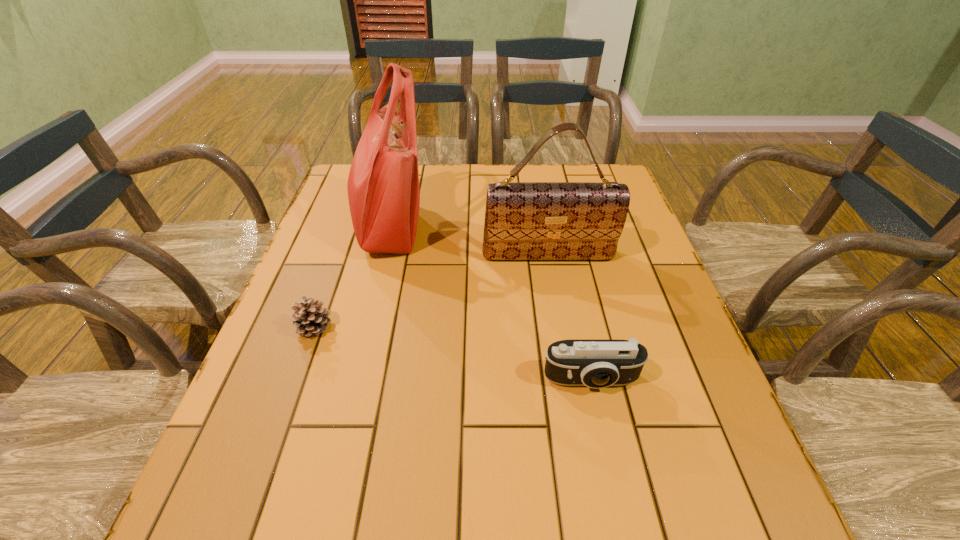
At what (x,y) coordinates should I click in order to perform the action: click on free space at the right edge. Please return your answer as a coordinate pair (x, y). Looking at the image, I should click on coord(729,483).

Locate an element on the screen. free space at the far left corner of the desktop is located at coordinates (341, 194).

The image size is (960, 540). Identify the location of vacant space at the far right corner of the desktop. (592, 166).

I want to click on vacant region at the near right corner of the desktop, so click(x=723, y=514).

I want to click on empty location between the shortest object and the shorter handbag, so click(432, 291).

At what (x,y) coordinates should I click in order to perform the action: click on vacant area that lies between the third farthest object and the third tallest object. Please return your answer as a coordinate pair (x, y). Looking at the image, I should click on (453, 354).

Where is `free space between the right handbag and the shortest object`? The height and width of the screenshot is (540, 960). free space between the right handbag and the shortest object is located at coordinates (432, 291).

Locate an element on the screen. Image resolution: width=960 pixels, height=540 pixels. empty space that is in between the camera and the pinecone is located at coordinates (453, 354).

I want to click on vacant space in between the taller handbag and the second shortest object, so click(x=490, y=303).

The image size is (960, 540). Find the location of `free point between the second tallest object and the second nearest object`. free point between the second tallest object and the second nearest object is located at coordinates (x=432, y=291).